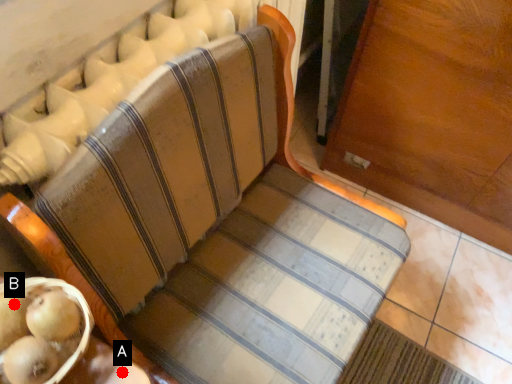
Question: Two points are circled on the image, labeled by A and B beside each circle. Among these points, which one is farthest from the camera?

Choices:
 (A) A is further
 (B) B is further

Answer: (A)